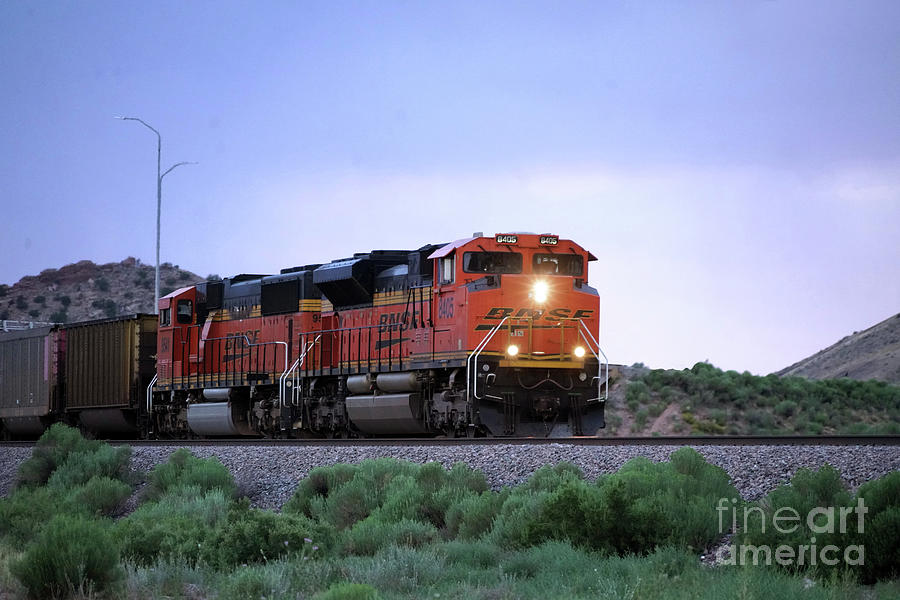
The height and width of the screenshot is (600, 900). I want to click on storage container, so click(111, 373), click(30, 367).